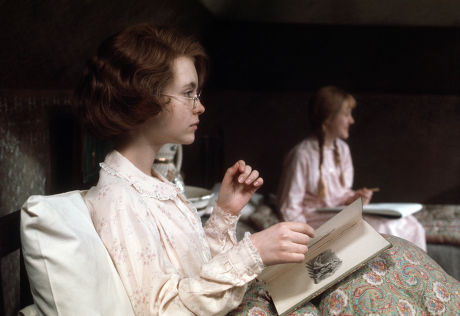
This screenshot has height=316, width=460. I want to click on pillow, so click(55, 236), click(76, 275), click(86, 289).